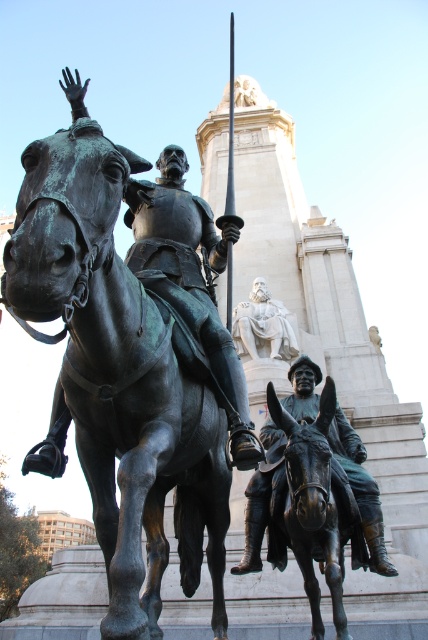
Question: Which point is closer to the camera?

Choices:
 (A) bronze statue of man on donkey at lower right
 (B) bronze horse at lower center

Answer: (B)

Question: Does bronze statue of man on donkey at lower right have a larger size compared to white marble statue at center?

Choices:
 (A) no
 (B) yes

Answer: (B)

Question: Which of the following is the closest to the observer?

Choices:
 (A) green patina horse at center
 (B) bronze statue of man on donkey at lower right

Answer: (A)

Question: Which object is farther from the camera taking this photo?

Choices:
 (A) white marble statue at center
 (B) bronze horse at lower center
 (C) bronze statue of man on donkey at lower right

Answer: (A)

Question: Can you confirm if bronze statue of man on donkey at lower right is bigger than white marble statue at center?

Choices:
 (A) yes
 (B) no

Answer: (A)

Question: From the image, what is the correct spatial relationship of green patina horse at center in relation to bronze horse at lower center?

Choices:
 (A) right
 (B) left

Answer: (B)